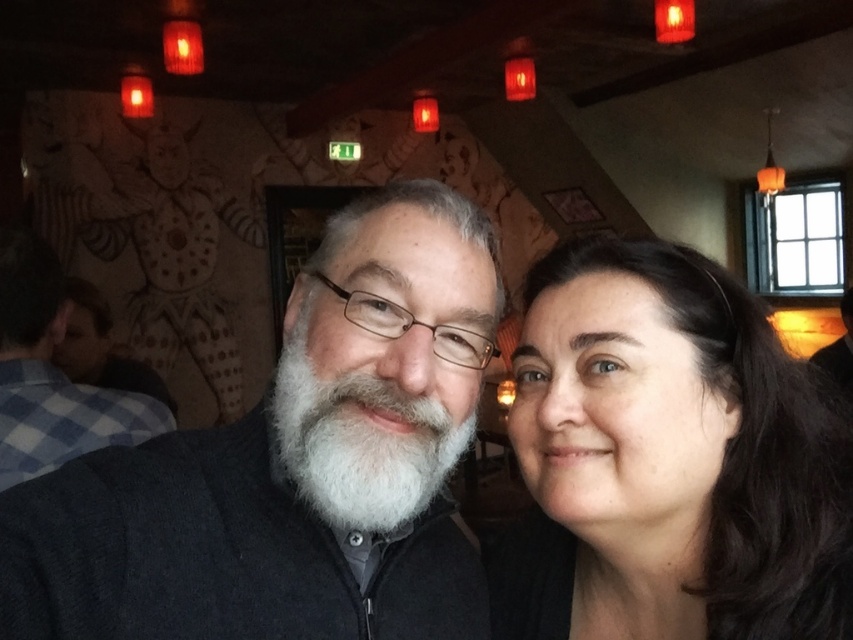
You are standing in the room and want to place a small decorative item on the closest point between point (x=254, y=609) and point (x=576, y=460). Which point should you choose?

Point (x=254, y=609) is closer to the viewer than point (x=576, y=460), so you should choose point (x=254, y=609).

You are a photographer trying to capture a closeup of the dark gray sweater at center and the white beard at center in the scene. Since you want to focus on both, which object should you adjust your camera to prioritize focusing on first, considering their sizes?

The dark gray sweater at center is shorter than white beard at center, so you should prioritize focusing on the white beard at center first since it is larger in the frame.